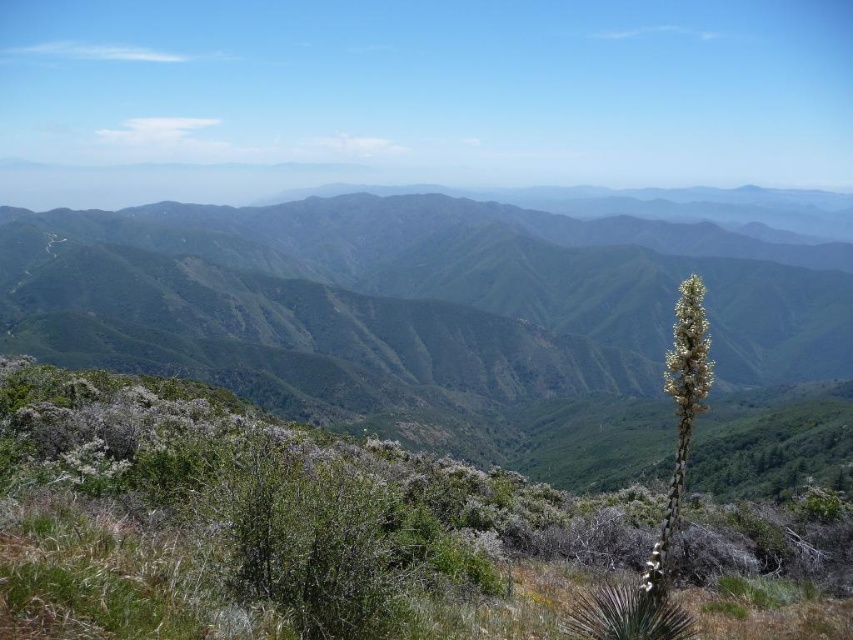
Between green textured mountain range at center and green leafy plant at center, which one appears on the right side from the viewer's perspective?

green leafy plant at center is more to the right.

Is green textured mountain range at center below green leafy plant at center?

No, green textured mountain range at center is not below green leafy plant at center.

Measure the distance between point (x=543, y=272) and camera.

Point (x=543, y=272) and camera are 943.04 feet apart.

You are a GUI agent. You are given a task and a screenshot of the screen. Output one action in this format:
    pyautogui.click(x=<x>, y=<y>)
    Task: Click on the green textured mountain range at center
    This screenshot has width=853, height=640.
    Given the screenshot: What is the action you would take?
    pyautogui.click(x=450, y=324)